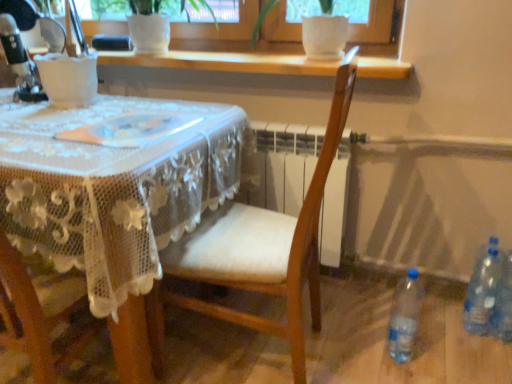
The width and height of the screenshot is (512, 384). Find the location of `vacant space in front of clear plastic bottle at lower right, the third bottle when ordered from left to right`. vacant space in front of clear plastic bottle at lower right, the third bottle when ordered from left to right is located at coordinates (496, 360).